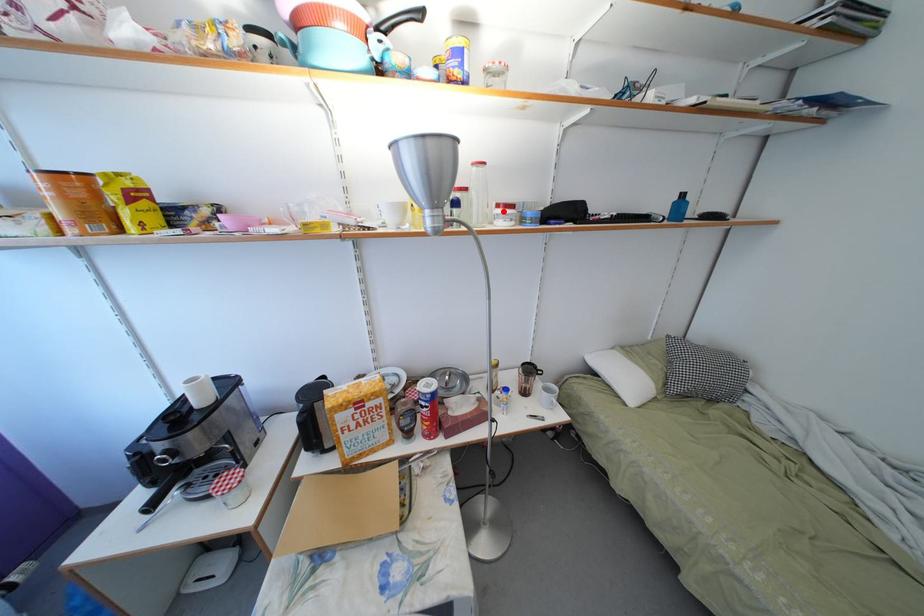
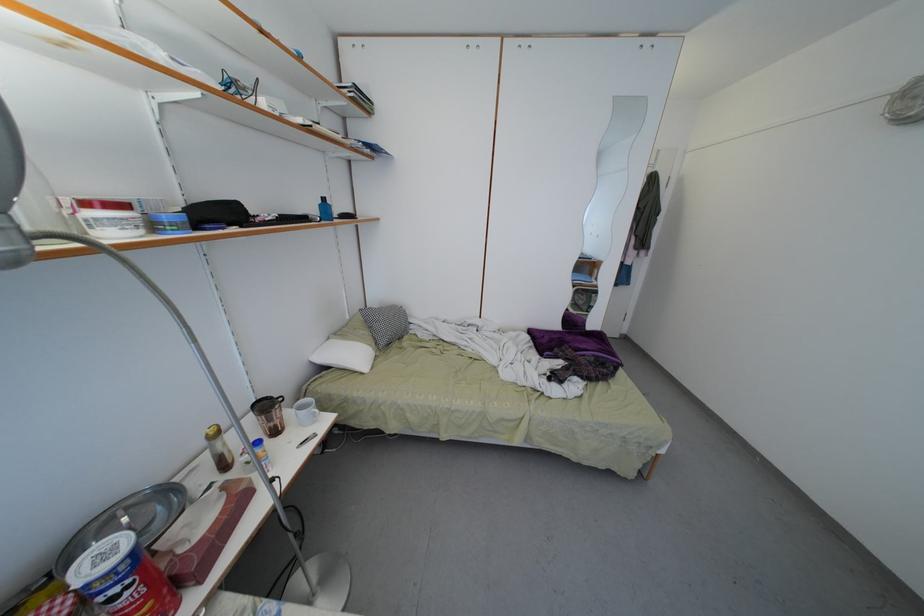
In the second image, find the point that corresponds to the highlighted location in the first image.

(91, 209)